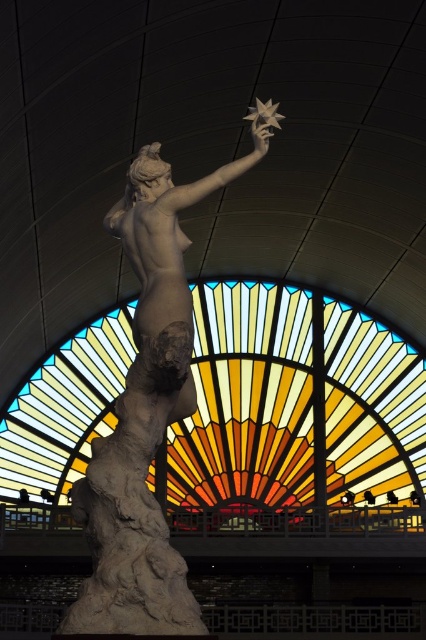
Question: Which object appears farthest from the camera in this image?

Choices:
 (A) stained glass at center
 (B) metallic silver star at upper center

Answer: (A)

Question: Which of these objects is positioned farthest from the matte stone statue at center?

Choices:
 (A) metallic silver star at upper center
 (B) stained glass at center

Answer: (B)

Question: Which of the following is the closest to the observer?

Choices:
 (A) matte stone statue at center
 (B) metallic silver star at upper center
 (C) stained glass at center

Answer: (A)

Question: Is stained glass at center above matte stone statue at center?

Choices:
 (A) yes
 (B) no

Answer: (B)

Question: Is the position of stained glass at center more distant than that of metallic silver star at upper center?

Choices:
 (A) yes
 (B) no

Answer: (A)

Question: In this image, where is stained glass at center located relative to matte stone statue at center?

Choices:
 (A) left
 (B) right

Answer: (B)